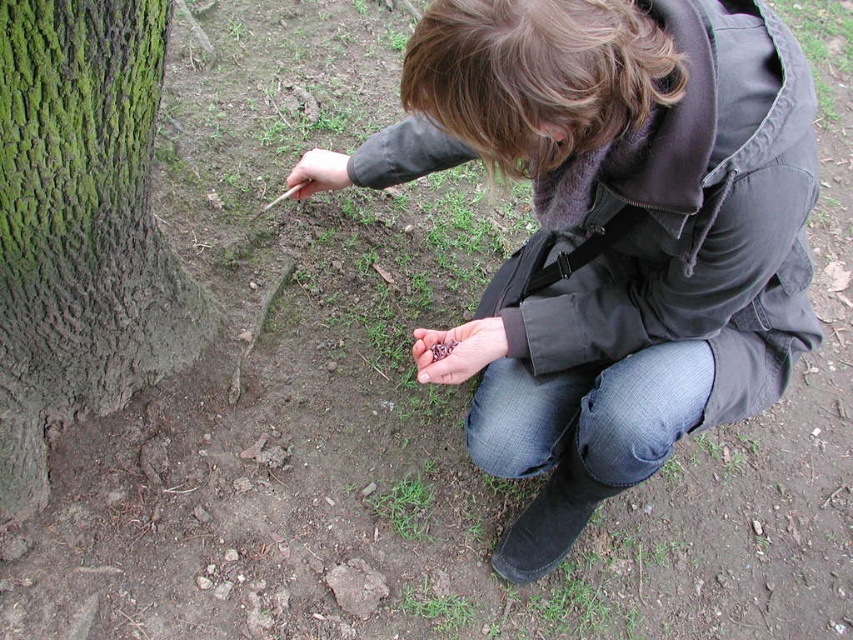
Question: Among these objects, which one is farthest from the camera?

Choices:
 (A) green rough bark at lower left
 (B) purple matte berries at center

Answer: (B)

Question: Is purple matte berries at center positioned behind matte brown stick at center?

Choices:
 (A) no
 (B) yes

Answer: (A)

Question: Does matte black jacket at center have a lesser width compared to matte brown stick at center?

Choices:
 (A) no
 (B) yes

Answer: (A)

Question: Among these objects, which one is farthest from the camera?

Choices:
 (A) purple matte berries at center
 (B) matte black jacket at center
 (C) matte brown stick at center
 (D) green rough bark at lower left

Answer: (C)

Question: Estimate the real-world distances between objects in this image. Which object is farther from the matte brown stick at center?

Choices:
 (A) matte black jacket at center
 (B) purple matte berries at center

Answer: (A)

Question: Does matte black jacket at center have a greater width compared to green rough bark at lower left?

Choices:
 (A) yes
 (B) no

Answer: (A)